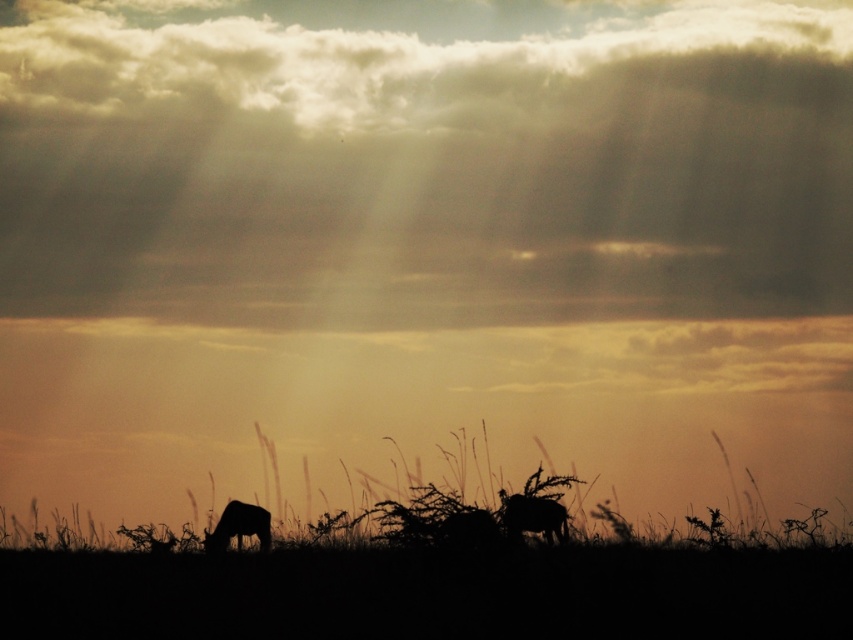
Is silhouette fur at center above silhouette elephant at lower left?

Indeed, silhouette fur at center is positioned over silhouette elephant at lower left.

The image size is (853, 640). What are the coordinates of `silhouette fur at center` in the screenshot? It's located at (532, 516).

Locate an element on the screen. This screenshot has width=853, height=640. cloudy sky at upper center is located at coordinates (425, 164).

This screenshot has height=640, width=853. In order to click on cloudy sky at upper center in this screenshot , I will do `click(425, 164)`.

The height and width of the screenshot is (640, 853). Identify the location of cloudy sky at upper center. (425, 164).

Find the location of a particular element. cloudy sky at upper center is located at coordinates [x=425, y=164].